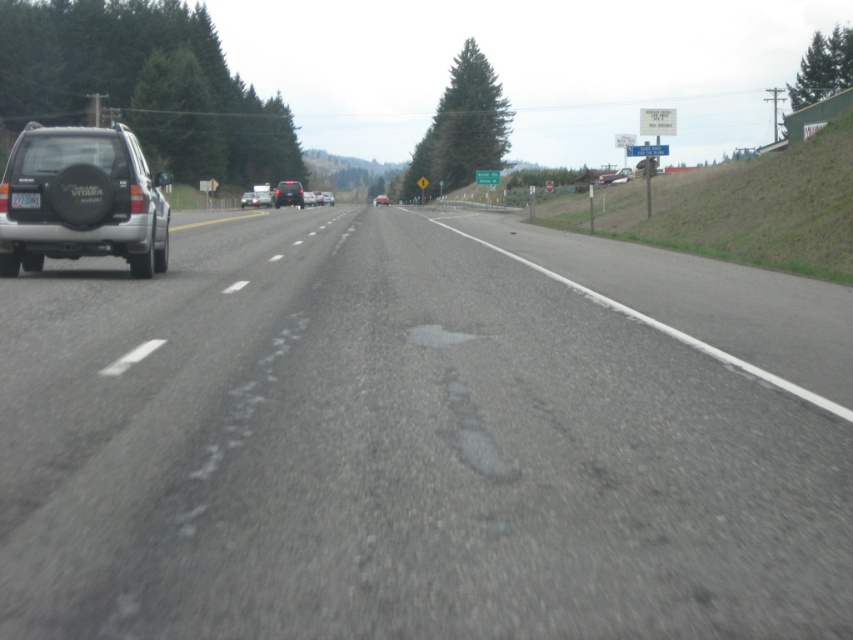
You are a driver approaching the highway and want to check the license plate number of the silver SUV. Where exactly is the black plastic license plate at left located in the image?

The black plastic license plate at left is located at point coordinates of (25, 198).

Consider the image. You are a driver approaching the highway and see the gray asphalt road at center and the matte black car at center. Which object is lower in height?

The gray asphalt road at center has a lesser height compared to the matte black car at center, so the gray asphalt road at center is lower in height.

You are a driver approaching the highway and see the gray asphalt road at center and the matte black car at center. Which object is positioned lower in the image?

The gray asphalt road at center is positioned below the matte black car at center, so it is lower in the image.